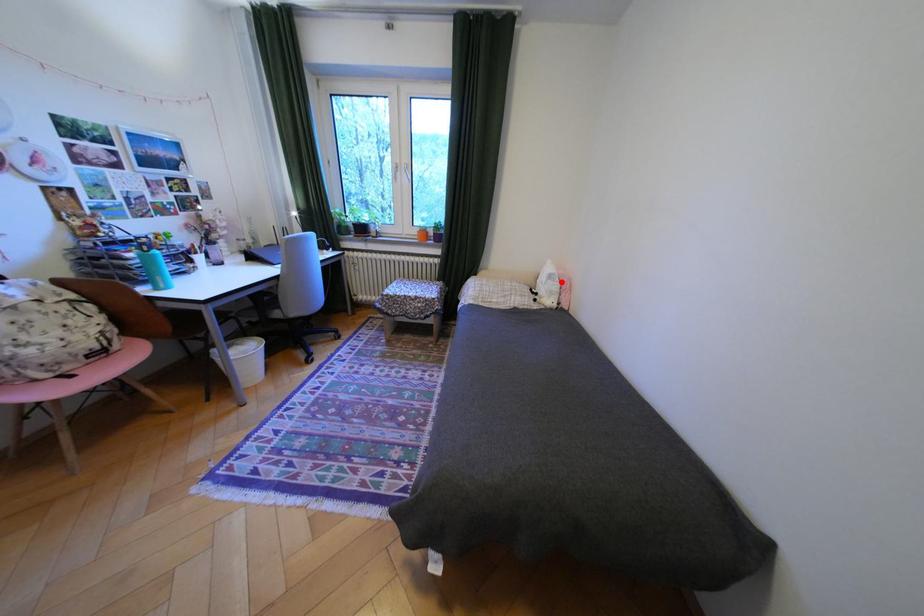
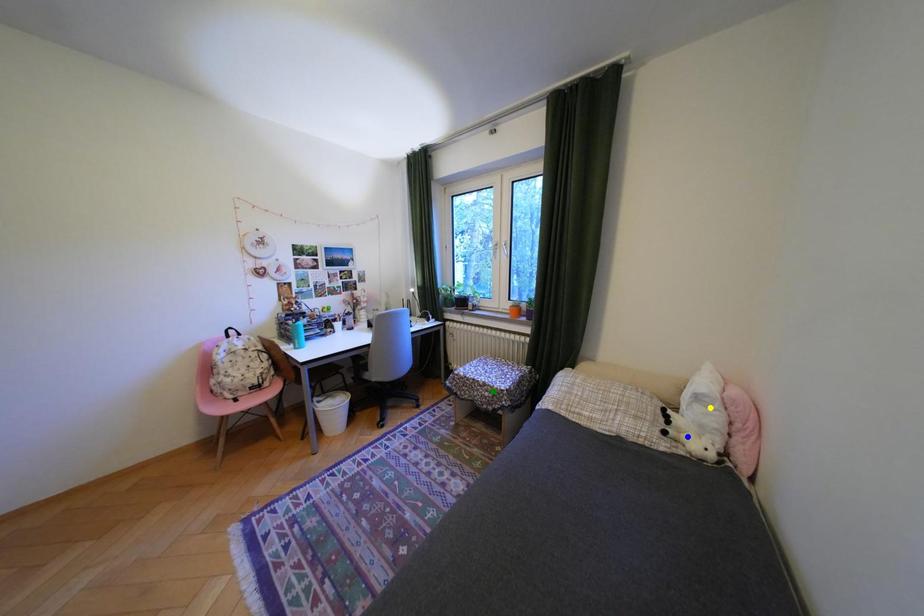
Question: I am providing you with two images of the same scene from different viewpoints. A red point is marked on the first image. You are given multiple points on the second image. Can you choose the point in image 2 that corresponds to the point in image 1?

Choices:
 (A) blue point
 (B) yellow point
 (C) green point

Answer: (B)